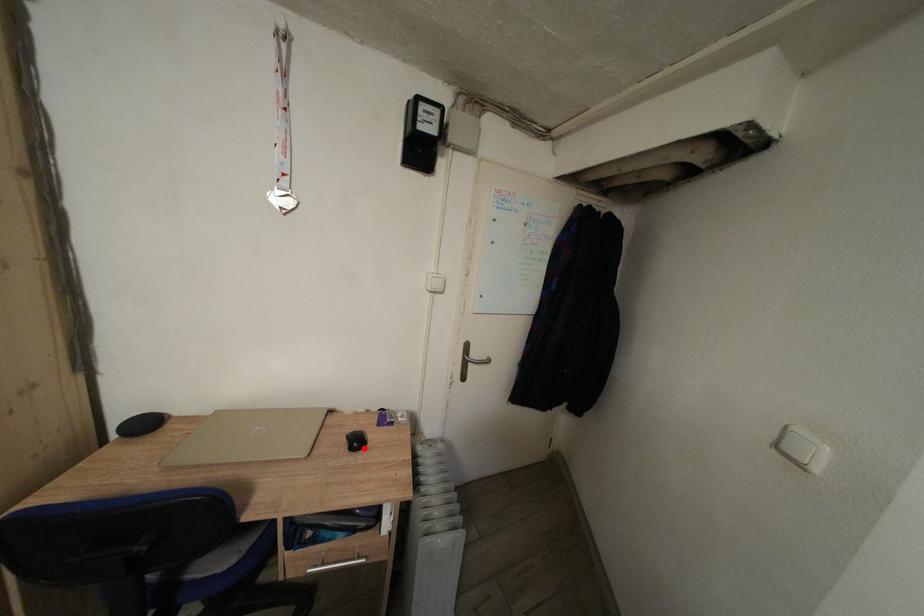
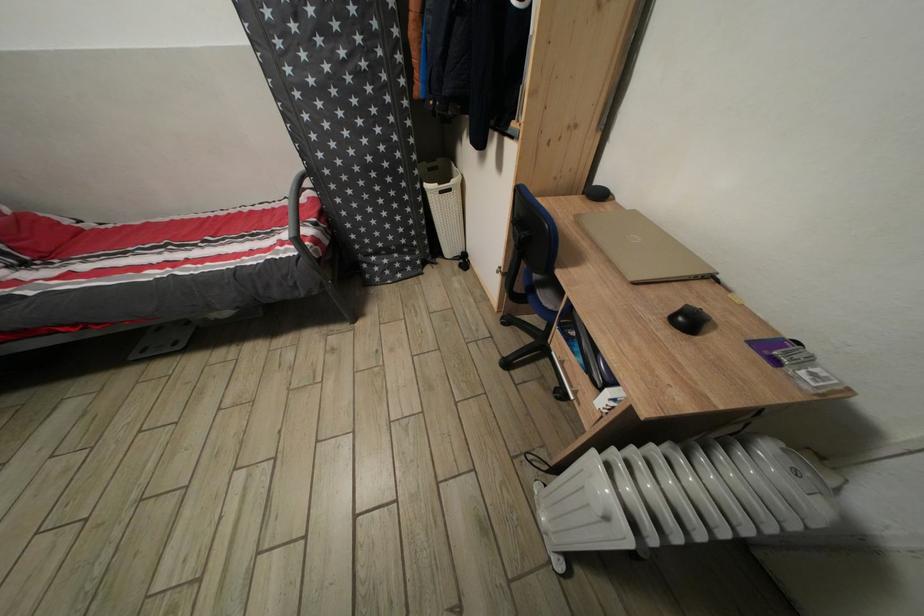
The point at the highlighted location is marked in the first image. Where is the corresponding point in the second image?

(696, 328)